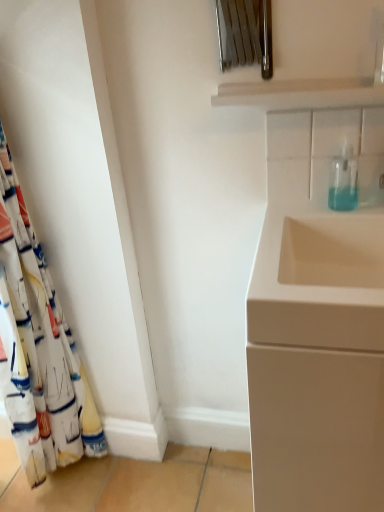
Question: Does matte white cabinet at right have a greater height compared to white fabric curtain at left?

Choices:
 (A) no
 (B) yes

Answer: (A)

Question: From a real-world perspective, is matte white cabinet at right over white fabric curtain at left?

Choices:
 (A) yes
 (B) no

Answer: (B)

Question: Is matte white cabinet at right behind white fabric curtain at left?

Choices:
 (A) yes
 (B) no

Answer: (B)

Question: Is matte white cabinet at right looking in the opposite direction of white fabric curtain at left?

Choices:
 (A) no
 (B) yes

Answer: (A)

Question: From the image's perspective, is matte white cabinet at right under white fabric curtain at left?

Choices:
 (A) yes
 (B) no

Answer: (A)

Question: In the image, is white fabric curtain at left on the left side or the right side of matte white cabinet at right?

Choices:
 (A) right
 (B) left

Answer: (B)

Question: Is point (23, 238) closer or farther from the camera than point (292, 293)?

Choices:
 (A) closer
 (B) farther

Answer: (B)

Question: Is white fabric curtain at left wider or thinner than matte white cabinet at right?

Choices:
 (A) wide
 (B) thin

Answer: (B)

Question: Relative to matte white cabinet at right, is white fabric curtain at left in front or behind?

Choices:
 (A) behind
 (B) front

Answer: (A)

Question: Is point (347, 278) positioned closer to the camera than point (347, 176)?

Choices:
 (A) closer
 (B) farther

Answer: (A)

Question: In terms of size, does matte white cabinet at right appear bigger or smaller than transparent plastic soap dispenser at upper right?

Choices:
 (A) small
 (B) big

Answer: (B)

Question: From the image's perspective, is matte white cabinet at right above or below transparent plastic soap dispenser at upper right?

Choices:
 (A) above
 (B) below

Answer: (B)

Question: Is matte white cabinet at right spatially inside transparent plastic soap dispenser at upper right, or outside of it?

Choices:
 (A) outside
 (B) inside

Answer: (A)

Question: From a real-world perspective, is transparent plastic soap dispenser at upper right physically located above or below white fabric curtain at left?

Choices:
 (A) above
 (B) below

Answer: (A)

Question: Considering the positions of transparent plastic soap dispenser at upper right and white fabric curtain at left in the image, is transparent plastic soap dispenser at upper right wider or thinner than white fabric curtain at left?

Choices:
 (A) thin
 (B) wide

Answer: (A)